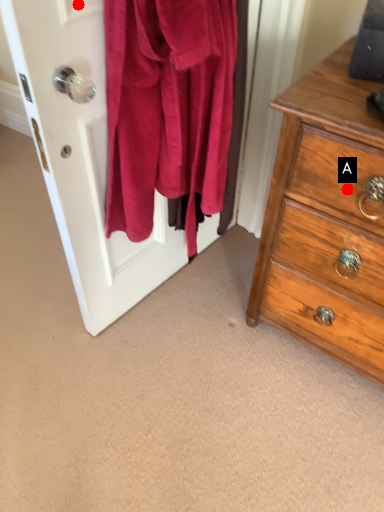
Question: Two points are circled on the image, labeled by A and B beside each circle. Which point is closer to the camera taking this photo?

Choices:
 (A) A is closer
 (B) B is closer

Answer: (B)